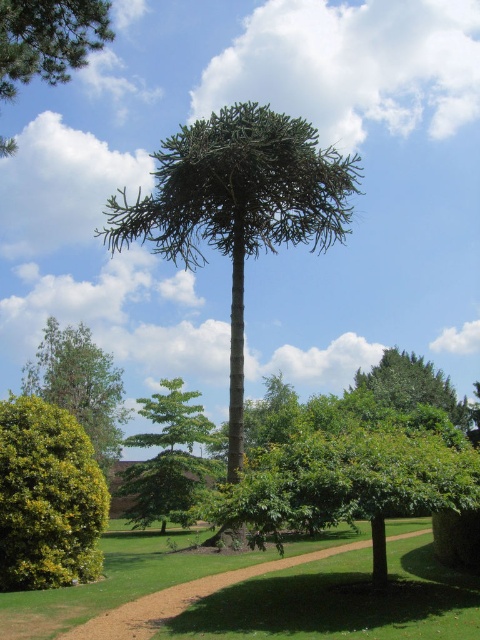
Does green leafy tree at upper left come behind green leafy tree at lower left?

No, it is in front of green leafy tree at lower left.

Does green leafy tree at upper left have a greater width compared to green leafy tree at lower left?

In fact, green leafy tree at upper left might be narrower than green leafy tree at lower left.

Which is in front, point (73, 10) or point (98, 444)?

Positioned in front is point (73, 10).

This screenshot has width=480, height=640. I want to click on green leafy tree at upper left, so click(48, 38).

Does green leafy tree at center have a larger size compared to green leafy tree at upper left?

Indeed, green leafy tree at center has a larger size compared to green leafy tree at upper left.

Does green leafy tree at center have a smaller size compared to green leafy tree at upper left?

Actually, green leafy tree at center might be larger than green leafy tree at upper left.

Who is more forward, (x=163, y=440) or (x=14, y=42)?

Point (x=14, y=42) is more forward.

This screenshot has height=640, width=480. In order to click on green leafy tree at center in this screenshot , I will do `click(168, 458)`.

Does green leafy bush at lower left lie behind green leafy tree at center?

No, it is not.

Who is higher up, green leafy bush at lower left or green leafy tree at center?

green leafy bush at lower left is higher up.

Identify the location of green leafy bush at lower left. The width and height of the screenshot is (480, 640). (48, 497).